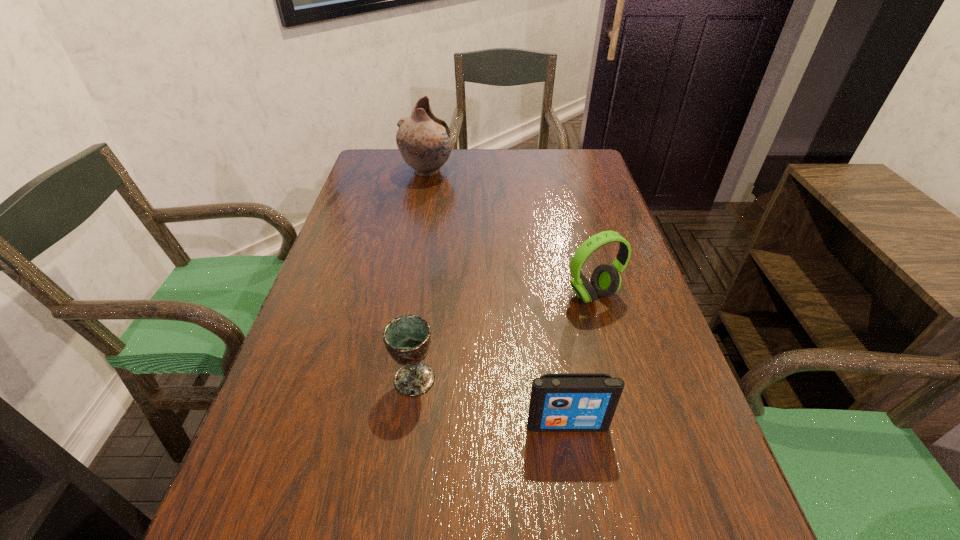
This screenshot has height=540, width=960. What are the coordinates of `object located in the far edge section of the desktop` in the screenshot? It's located at (424, 140).

I want to click on object located at the left edge, so click(424, 140).

Where is `headset that is positioned at the right edge`? The height and width of the screenshot is (540, 960). headset that is positioned at the right edge is located at coordinates (605, 280).

You are a GUI agent. You are given a task and a screenshot of the screen. Output one action in this format:
    pyautogui.click(x=<x>, y=<y>)
    Task: Click on the iPod that is at the right edge
    This screenshot has height=540, width=960.
    Given the screenshot: What is the action you would take?
    pyautogui.click(x=560, y=402)

Find the location of a particular element. The image size is (960, 540). object at the far left corner is located at coordinates (424, 140).

Locate an element on the screen. The height and width of the screenshot is (540, 960). free spot at the far edge of the desktop is located at coordinates (483, 161).

Locate an element on the screen. vacant space at the left edge is located at coordinates (315, 299).

You are a GUI agent. You are given a task and a screenshot of the screen. Output one action in this format:
    pyautogui.click(x=<x>, y=<y>)
    Task: Click on the free space at the right edge of the desktop
    The image size is (960, 540).
    Given the screenshot: What is the action you would take?
    687,409

You are a GUI agent. You are given a task and a screenshot of the screen. Output one action in this format:
    pyautogui.click(x=<x>, y=<y>)
    Task: Click on the vacant area at the far left corner
    
    Given the screenshot: What is the action you would take?
    pyautogui.click(x=398, y=182)

Image resolution: width=960 pixels, height=540 pixels. I want to click on vacant space at the far right corner of the desktop, so click(576, 160).